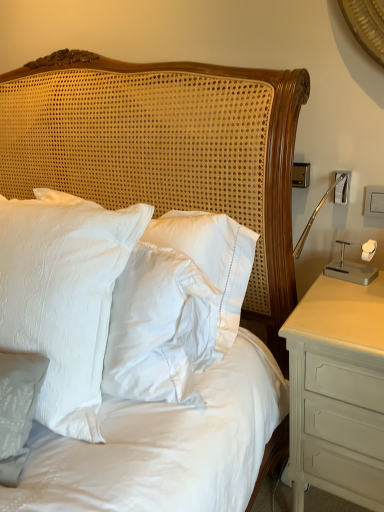
This screenshot has height=512, width=384. I want to click on free point above white painted wood nightstand at right (from a real-world perspective), so click(348, 298).